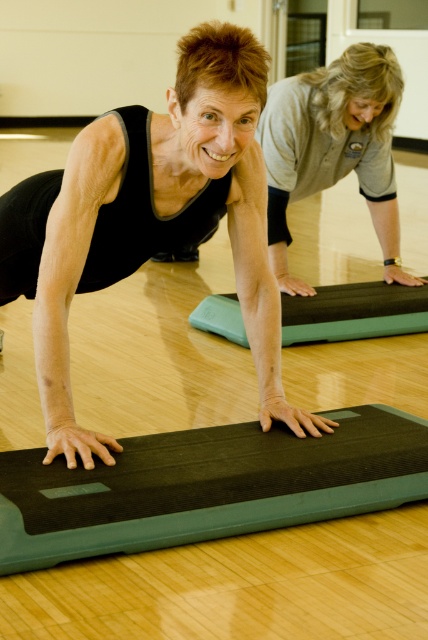
Question: Estimate the real-world distances between objects in this image. Which object is farther from the black rubber mat at center?

Choices:
 (A) green rubber yoga mat at center
 (B) black rubber yoga mat at center

Answer: (A)

Question: Does black rubber mat at center appear on the right side of black rubber yoga mat at center?

Choices:
 (A) no
 (B) yes

Answer: (A)

Question: Which point is farther to the camera?

Choices:
 (A) black rubber mat at center
 (B) black rubber yoga mat at center
 (C) green rubber yoga mat at center

Answer: (C)

Question: Is black rubber mat at center below black rubber yoga mat at center?

Choices:
 (A) yes
 (B) no

Answer: (B)

Question: Which is nearer to the black rubber yoga mat at center?

Choices:
 (A) black rubber mat at center
 (B) green rubber yoga mat at center

Answer: (A)

Question: Is the position of black rubber yoga mat at center less distant than that of green rubber yoga mat at center?

Choices:
 (A) yes
 (B) no

Answer: (A)